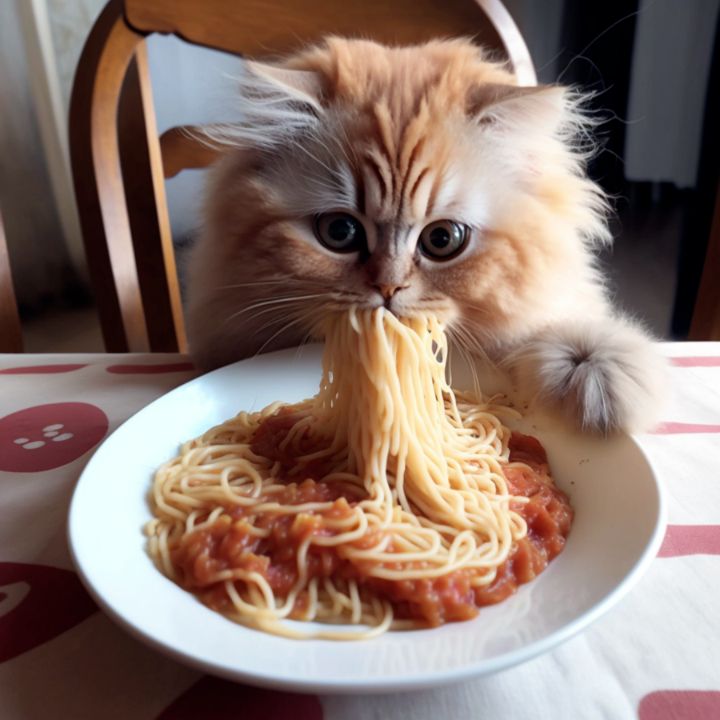
Find the location of a particular element. The width and height of the screenshot is (720, 720). chair back is located at coordinates (111, 58).